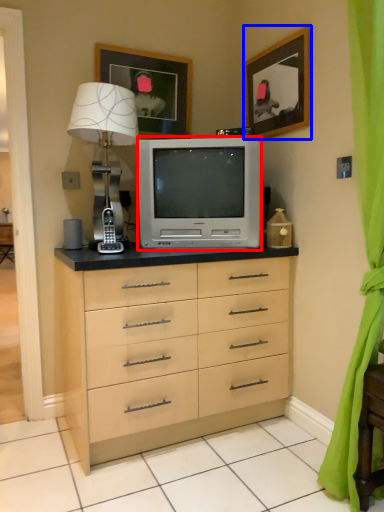
Question: Which of the following is the closest to the observer, television (highlighted by a red box) or picture frame (highlighted by a blue box)?

Choices:
 (A) television
 (B) picture frame

Answer: (B)